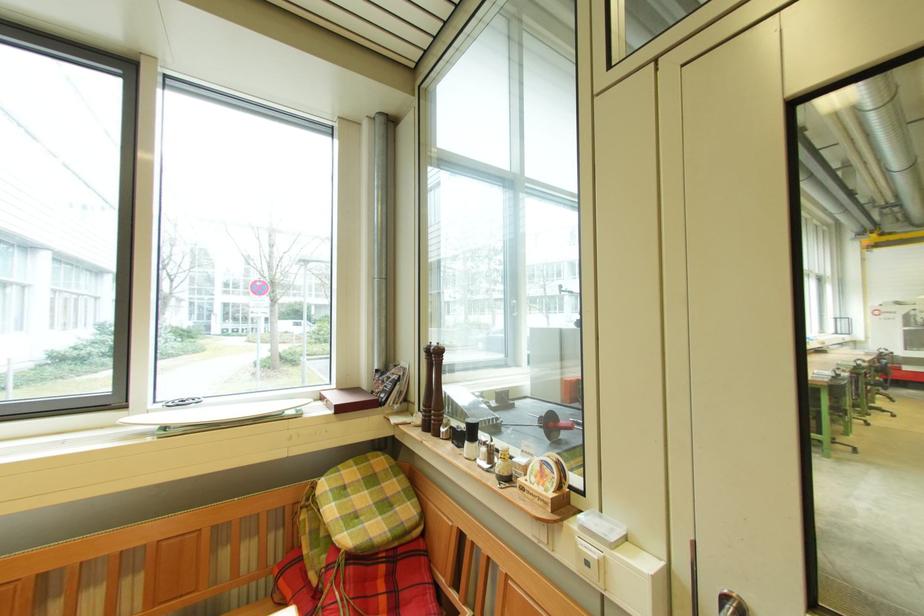
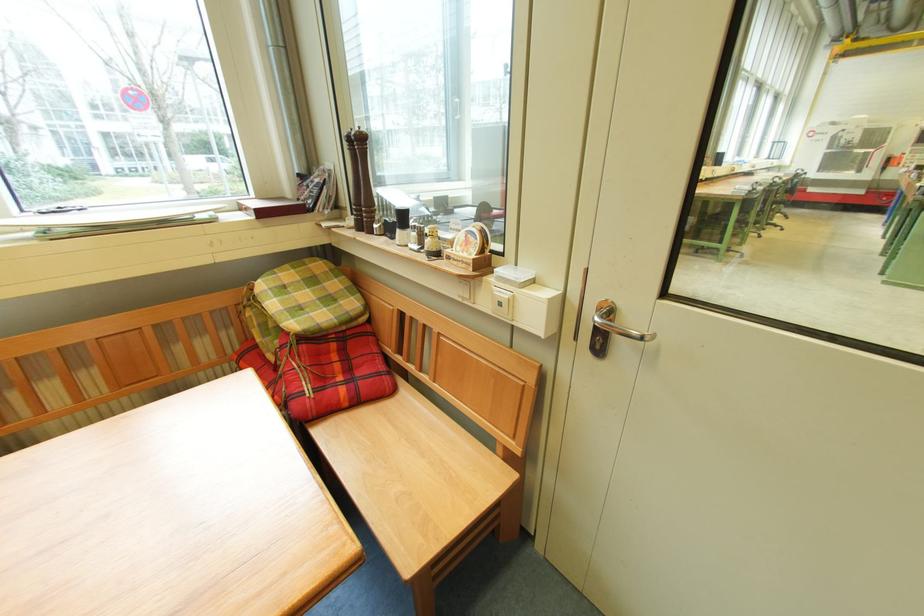
Where in the second image is the point corresponding to (594,567) from the first image?

(507, 307)